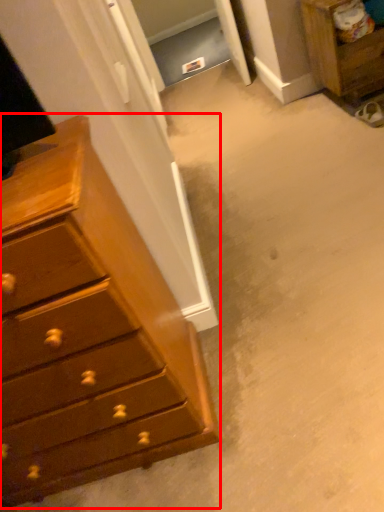
Question: In this image, where is chest of drawers (annotated by the red box) located relative to nightstand?

Choices:
 (A) right
 (B) left

Answer: (B)